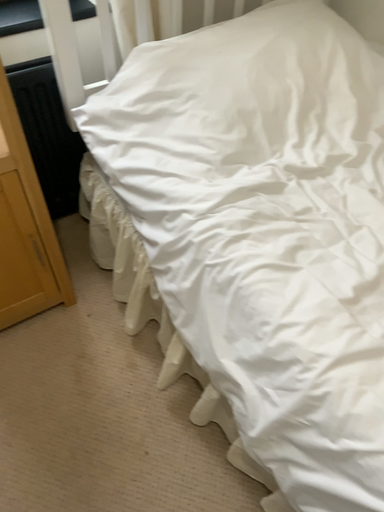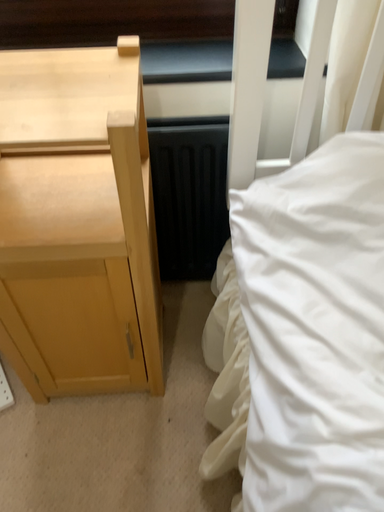
Question: Which way did the camera rotate in the video?

Choices:
 (A) rotated upward
 (B) rotated downward

Answer: (A)